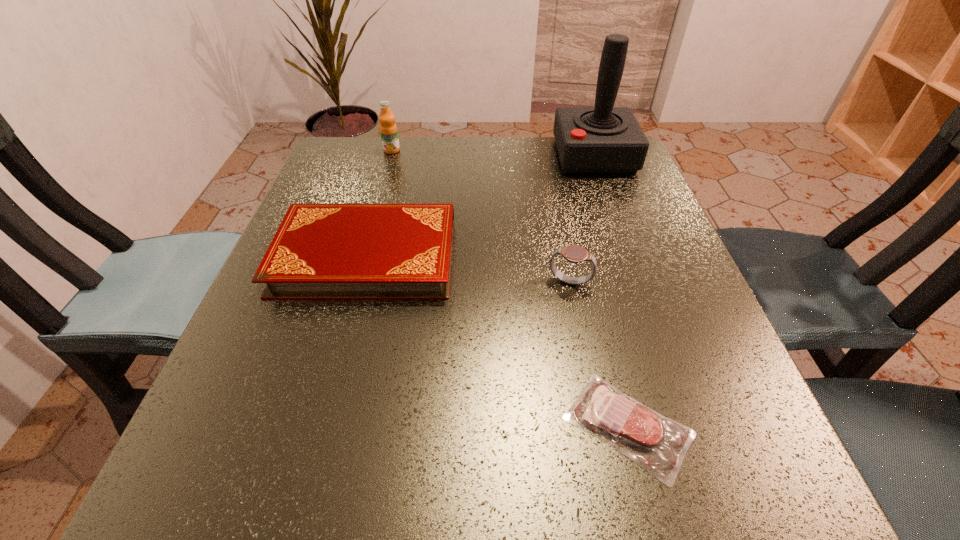
I want to click on object at the far left corner, so click(x=388, y=129).

Where is `object situated at the far right corner`? object situated at the far right corner is located at coordinates (602, 139).

Where is `object located in the near right corner section of the desktop`? The width and height of the screenshot is (960, 540). object located in the near right corner section of the desktop is located at coordinates (658, 444).

The image size is (960, 540). What are the coordinates of `vacant point at the far edge` in the screenshot? It's located at (501, 184).

The image size is (960, 540). Identify the location of vacant space at the near edge of the desktop. (374, 460).

In the image, there is a desktop. What are the coordinates of `vacant space at the right edge` in the screenshot? It's located at (629, 206).

Locate an element on the screen. This screenshot has width=960, height=540. free location at the far left corner of the desktop is located at coordinates (328, 168).

In the image, there is a desktop. Where is `vacant space at the far right corner`? The height and width of the screenshot is (540, 960). vacant space at the far right corner is located at coordinates (588, 174).

Identify the location of free space at the near right corner of the desktop. Image resolution: width=960 pixels, height=540 pixels. (782, 511).

You are a GUI agent. You are given a task and a screenshot of the screen. Output one action in this format:
    pyautogui.click(x=<x>, y=<y>)
    Task: Click on the vacant area that lies between the third shortest object and the joystick
    Image resolution: width=960 pixels, height=540 pixels.
    Given the screenshot: What is the action you would take?
    pyautogui.click(x=582, y=219)